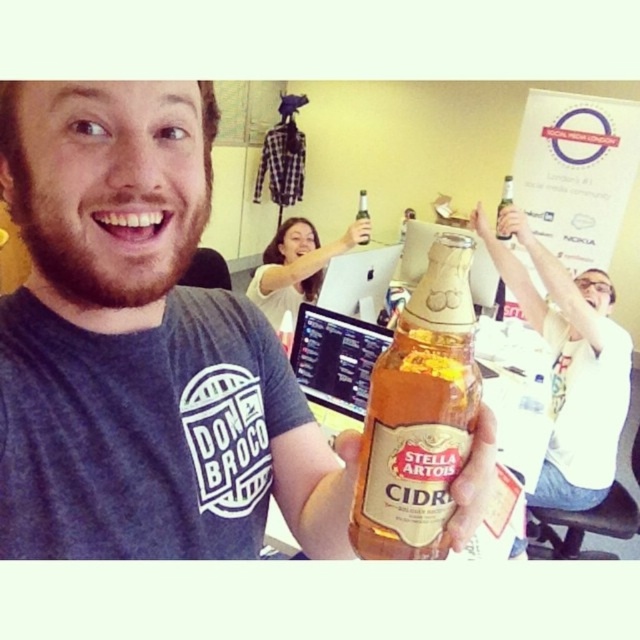
Can you confirm if golden glass bottle at center is smaller than matte gold beer bottle at upper center?

Yes, golden glass bottle at center is smaller than matte gold beer bottle at upper center.

Can you confirm if golden glass bottle at center is thinner than matte gold beer bottle at upper center?

Yes, golden glass bottle at center is thinner than matte gold beer bottle at upper center.

Does point (417, 316) come in front of point (522, 220)?

Yes, point (417, 316) is closer to viewer.

Where is `golden glass bottle at center`? The height and width of the screenshot is (640, 640). golden glass bottle at center is located at coordinates (419, 416).

Which is above, matte black t-shirt at center or matte gold beer bottle at upper center?

matte gold beer bottle at upper center is higher up.

Who is shorter, matte black t-shirt at center or matte gold beer bottle at upper center?

matte gold beer bottle at upper center is shorter.

The width and height of the screenshot is (640, 640). I want to click on matte black t-shirt at center, so click(x=140, y=348).

Locate an element on the screen. This screenshot has width=640, height=640. matte black t-shirt at center is located at coordinates (140, 348).

Who is more forward, (476, 220) or (506, 195)?

Point (476, 220)

Is point (561, 429) farther from camera compared to point (506, 193)?

No, it is in front of (506, 193).

The width and height of the screenshot is (640, 640). In order to click on white matte shirt at upper right in this screenshot , I will do `click(572, 371)`.